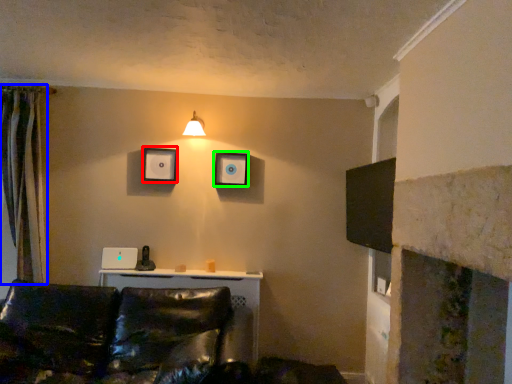
Question: Which object is positioned closest to picture frame (highlighted by a red box)? Select from curtain (highlighted by a blue box) and picture frame (highlighted by a green box).

Choices:
 (A) curtain
 (B) picture frame

Answer: (B)